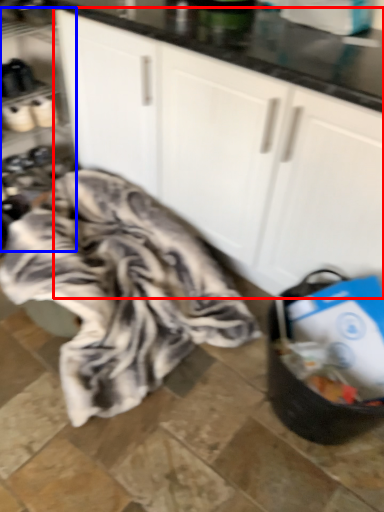
Question: Which object appears farthest to the camera in this image, cabinetry (highlighted by a red box) or shelf (highlighted by a blue box)?

Choices:
 (A) cabinetry
 (B) shelf

Answer: (B)